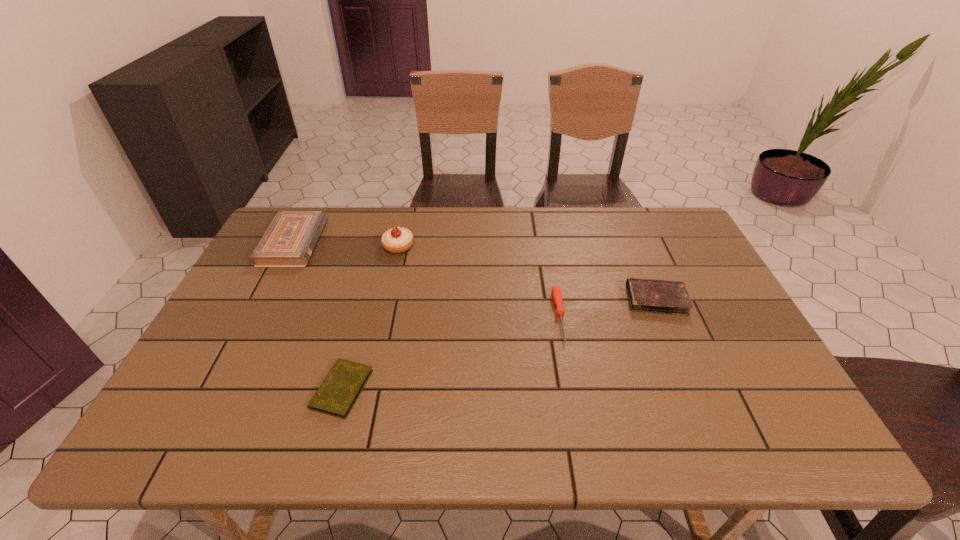
This screenshot has height=540, width=960. In order to click on free space that satisfies the following two spatial constraints: 1. on the spine side of the second tallest object; 2. on the back side of the farther diary in this screenshot , I will do `click(265, 300)`.

Where is `free space that satisfies the following two spatial constraints: 1. on the front side of the taller diary; 2. on the right side of the pastry`? Image resolution: width=960 pixels, height=540 pixels. free space that satisfies the following two spatial constraints: 1. on the front side of the taller diary; 2. on the right side of the pastry is located at coordinates (387, 300).

At what (x,y) coordinates should I click in order to perform the action: click on free space that satisfies the following two spatial constraints: 1. on the spine side of the leftmost object; 2. on the back side of the left diary. Please return your answer as a coordinate pair (x, y). Image resolution: width=960 pixels, height=540 pixels. Looking at the image, I should click on (219, 389).

Find the location of a particular element. The height and width of the screenshot is (540, 960). free space in the image that satisfies the following two spatial constraints: 1. on the spine side of the shortest object; 2. on the right side of the leftmost object is located at coordinates (219, 389).

The image size is (960, 540). Find the location of `blank area in the image that satisfies the following two spatial constraints: 1. on the back side of the farther diary; 2. on the left side of the shorter diary`. blank area in the image that satisfies the following two spatial constraints: 1. on the back side of the farther diary; 2. on the left side of the shorter diary is located at coordinates 367,300.

Locate an element on the screen. The width and height of the screenshot is (960, 540). vacant area in the image that satisfies the following two spatial constraints: 1. on the spine side of the Bible; 2. on the right side of the pastry is located at coordinates point(292,246).

Locate an element on the screen. This screenshot has height=540, width=960. free location that satisfies the following two spatial constraints: 1. on the back side of the third shortest object; 2. on the right side of the nearest object is located at coordinates (367, 300).